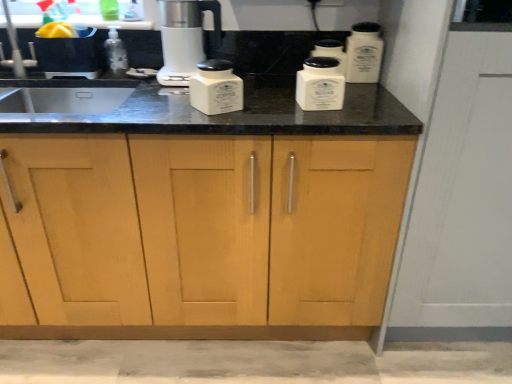
Question: Is the depth of satin white coffee maker at center greater than that of light wood cabinet at center?

Choices:
 (A) yes
 (B) no

Answer: (A)

Question: From the image's perspective, is satin white coffee maker at center on top of light wood cabinet at center?

Choices:
 (A) yes
 (B) no

Answer: (A)

Question: Could you tell me if satin white coffee maker at center is facing light wood cabinet at center?

Choices:
 (A) yes
 (B) no

Answer: (A)

Question: Does satin white coffee maker at center appear on the left side of light wood cabinet at center?

Choices:
 (A) yes
 (B) no

Answer: (B)

Question: Can you confirm if satin white coffee maker at center is bigger than light wood cabinet at center?

Choices:
 (A) yes
 (B) no

Answer: (B)

Question: Visually, is satin white coffee maker at center positioned to the left or to the right of light wood cabinet at center?

Choices:
 (A) left
 (B) right

Answer: (B)

Question: From the image's perspective, is satin white coffee maker at center located above or below light wood cabinet at center?

Choices:
 (A) below
 (B) above

Answer: (B)

Question: From a real-world perspective, is satin white coffee maker at center above or below light wood cabinet at center?

Choices:
 (A) below
 (B) above

Answer: (B)

Question: Looking at the image, does satin white coffee maker at center seem bigger or smaller compared to light wood cabinet at center?

Choices:
 (A) big
 (B) small

Answer: (B)

Question: Considering the positions of point (112, 59) and point (168, 279), is point (112, 59) closer or farther from the camera than point (168, 279)?

Choices:
 (A) closer
 (B) farther

Answer: (B)

Question: Visually, is transparent plastic bottle at left positioned to the left or to the right of light wood cabinet at center?

Choices:
 (A) right
 (B) left

Answer: (B)

Question: From a real-world perspective, relative to light wood cabinet at center, is transparent plastic bottle at left vertically above or below?

Choices:
 (A) above
 (B) below

Answer: (A)

Question: Choose the correct answer: Is transparent plastic bottle at left inside light wood cabinet at center or outside it?

Choices:
 (A) inside
 (B) outside

Answer: (A)

Question: In terms of height, does white ceramic container at upper right, which ranks as the 4th kitchen appliance in left-to-right order, look taller or shorter compared to white ceramic container at center, which is the second kitchen appliance from left to right?

Choices:
 (A) tall
 (B) short

Answer: (A)

Question: In terms of width, does white ceramic container at upper right, the 1th kitchen appliance positioned from the right, look wider or thinner when compared to white ceramic container at center, which is the second kitchen appliance from left to right?

Choices:
 (A) thin
 (B) wide

Answer: (B)